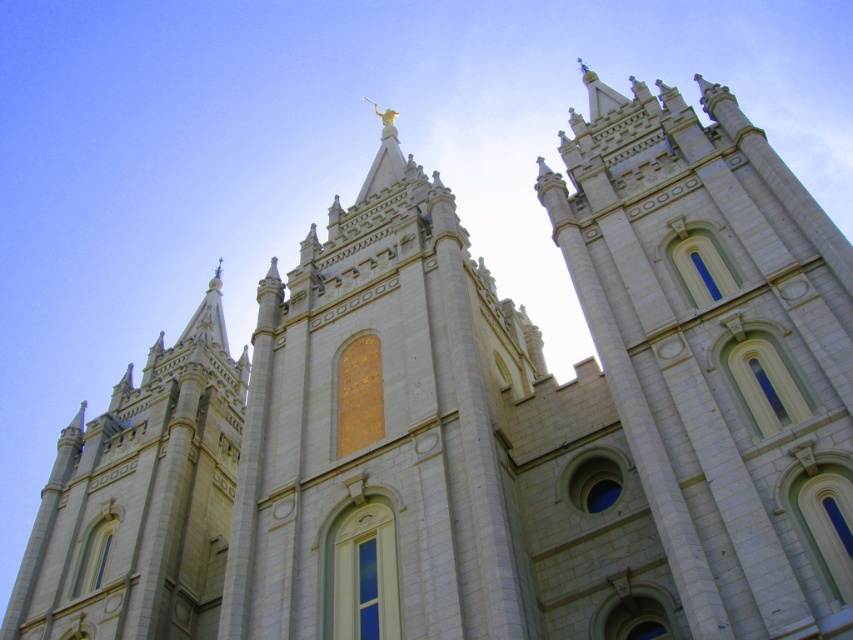
Question: Can you confirm if white stone tower at upper center is positioned above white stone tower at left?

Choices:
 (A) yes
 (B) no

Answer: (A)

Question: Which of the following is the closest to the observer?

Choices:
 (A) white stone tower at left
 (B) white stone tower at upper center

Answer: (B)

Question: Which of the following is the farthest from the observer?

Choices:
 (A) gold textured statue at center
 (B) white stone tower at upper center
 (C) white stone tower at left

Answer: (C)

Question: In this image, where is white stone tower at upper center located relative to white stone tower at left?

Choices:
 (A) below
 (B) above

Answer: (B)

Question: Where is white stone tower at upper center located in relation to gold textured statue at center in the image?

Choices:
 (A) left
 (B) right

Answer: (B)

Question: Which point appears farthest from the camera in this image?

Choices:
 (A) (138, 524)
 (B) (801, 474)

Answer: (A)